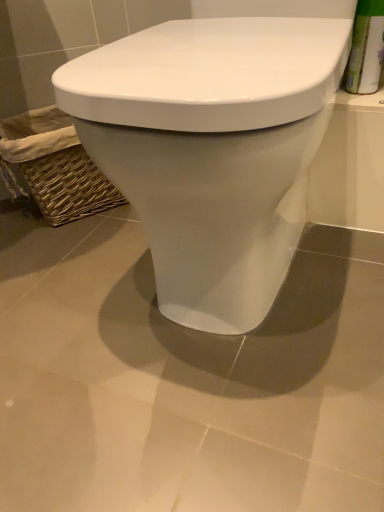
The width and height of the screenshot is (384, 512). What are the coordinates of `free spot in front of woven brown basket at lower left` in the screenshot? It's located at (77, 253).